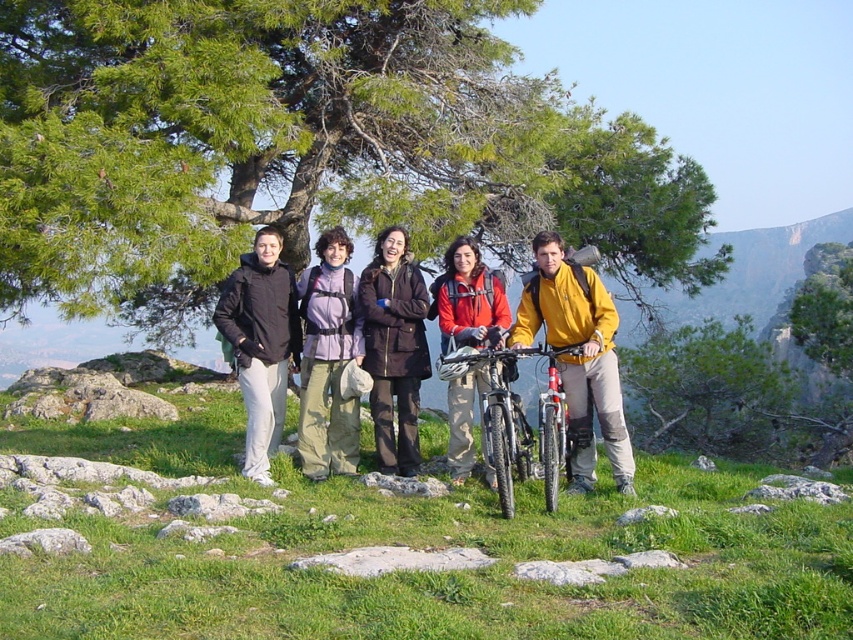
Looking at this image, is green leafy tree at upper center further to camera compared to yellow matte jacket at center?

Yes, it is behind yellow matte jacket at center.

What are the coordinates of `green leafy tree at upper center` in the screenshot? It's located at (303, 147).

Is point (508, 154) positioned in front of point (608, 380)?

That is False.

Where is `green leafy tree at upper center`? green leafy tree at upper center is located at coordinates (303, 147).

Is point (549, 368) less distant than point (448, 445)?

Yes, it is in front of point (448, 445).

Is black matte mountain bike at center positioned at the back of matte orange jacket at center?

That is False.

Who is more forward, (566, 460) or (473, 326)?

Positioned in front is point (566, 460).

Identify the location of black matte mountain bike at center. (521, 420).

Does point (457, 621) come behind point (561, 372)?

No, (457, 621) is in front of (561, 372).

Does green grassy at center appear on the right side of yellow matte jacket at center?

No, green grassy at center is not to the right of yellow matte jacket at center.

Where is `green grassy at center`? This screenshot has height=640, width=853. green grassy at center is located at coordinates (413, 547).

You are a GUI agent. You are given a task and a screenshot of the screen. Output one action in this format:
    pyautogui.click(x=<x>, y=<y>)
    Task: Click on the green grassy at center
    
    Given the screenshot: What is the action you would take?
    pyautogui.click(x=413, y=547)